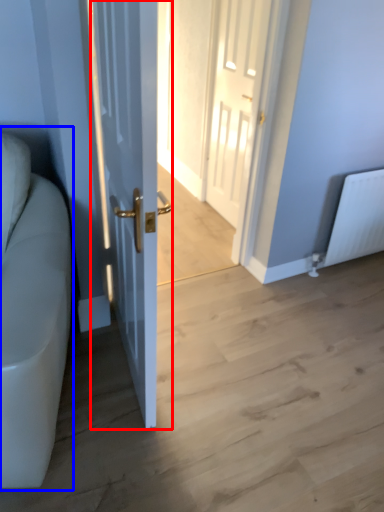
Question: Which object is closer to the camera taking this photo, door (highlighted by a red box) or couch (highlighted by a blue box)?

Choices:
 (A) door
 (B) couch

Answer: (B)